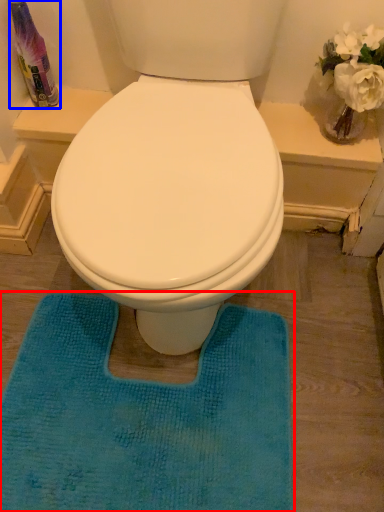
Question: Which object appears closest to the camera in this image, bath mat (highlighted by a red box) or cleaning product (highlighted by a blue box)?

Choices:
 (A) bath mat
 (B) cleaning product

Answer: (A)